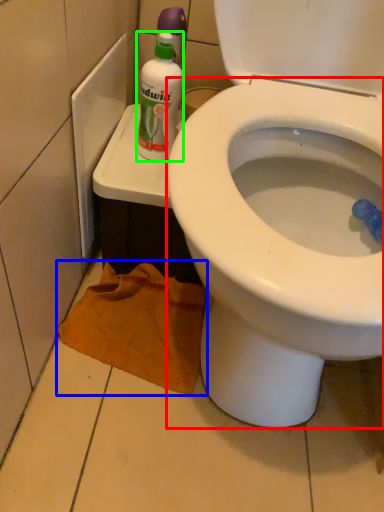
Question: Based on their relative distances, which object is farther from bidet (highlighted by a red box)? Choose from material (highlighted by a blue box) and cleaning product (highlighted by a green box).

Choices:
 (A) material
 (B) cleaning product

Answer: (B)